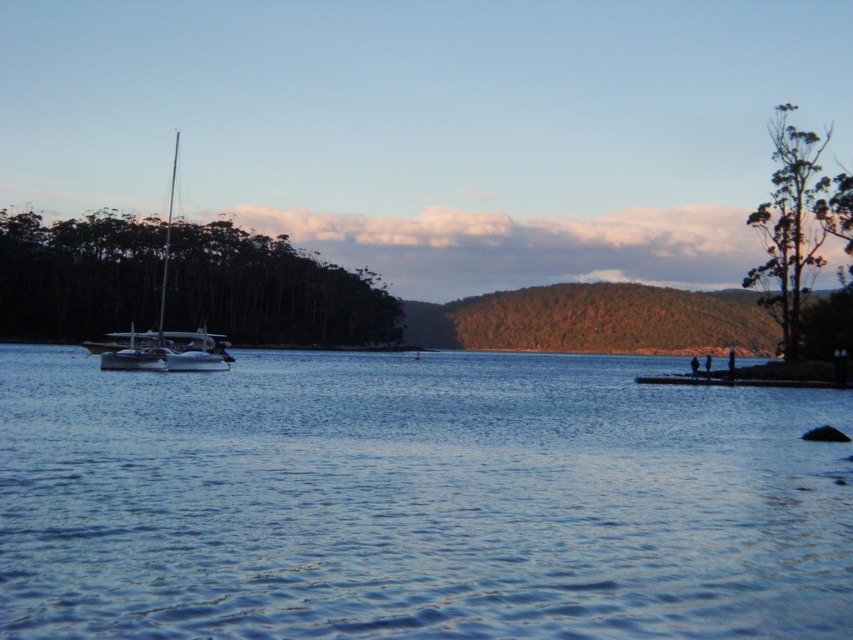
Question: Is blue water at center behind green matte tree at left?

Choices:
 (A) yes
 (B) no

Answer: (B)

Question: From the image, what is the correct spatial relationship of green leafy tree at upper right in relation to white glossy sailboat at left?

Choices:
 (A) above
 (B) below

Answer: (A)

Question: Among these points, which one is nearest to the camera?

Choices:
 (A) (65, 250)
 (B) (451, 406)

Answer: (B)

Question: Which of the following is the farthest from the observer?

Choices:
 (A) (793, 125)
 (B) (271, 472)
 (C) (155, 365)

Answer: (A)

Question: Is green leafy tree at upper right to the left of white glossy sailboat at left from the viewer's perspective?

Choices:
 (A) yes
 (B) no

Answer: (B)

Question: Which object appears farthest from the camera in this image?

Choices:
 (A) green leafy tree at upper right
 (B) green matte tree at left

Answer: (B)